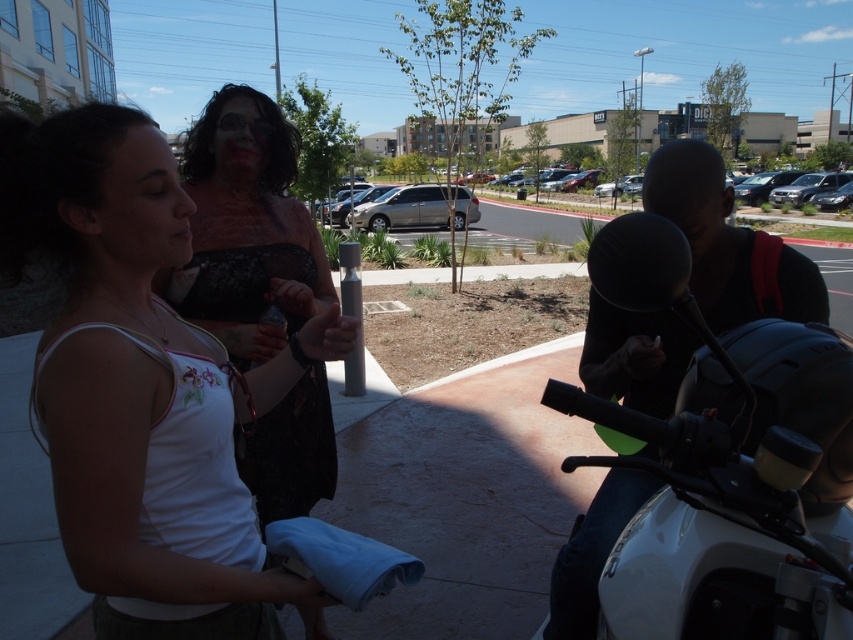
Is white fabric tank top at center bigger than white glossy motorcycle at right?

Actually, white fabric tank top at center might be smaller than white glossy motorcycle at right.

Measure the distance between point (137, 531) and camera.

They are 1.01 meters apart.

The image size is (853, 640). What do you see at coordinates (141, 385) in the screenshot? I see `white fabric tank top at center` at bounding box center [141, 385].

Where is `white fabric tank top at center`? white fabric tank top at center is located at coordinates (141, 385).